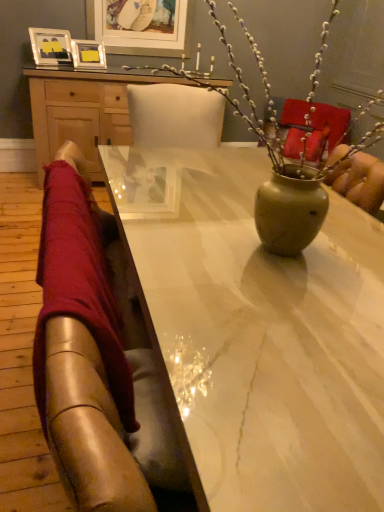
Question: Could wooden desk at upper center be considered to be inside matte green vase at center?

Choices:
 (A) no
 (B) yes

Answer: (A)

Question: Is matte green vase at center thinner than wooden desk at upper center?

Choices:
 (A) no
 (B) yes

Answer: (A)

Question: From the image's perspective, is matte green vase at center above wooden desk at upper center?

Choices:
 (A) yes
 (B) no

Answer: (B)

Question: Is matte green vase at center smaller than wooden desk at upper center?

Choices:
 (A) yes
 (B) no

Answer: (A)

Question: Does matte green vase at center have a lesser height compared to wooden desk at upper center?

Choices:
 (A) no
 (B) yes

Answer: (B)

Question: Would you say matte silver picture frame at upper left, which appears as the 3th picture frame when viewed from the right, is to the left or to the right of denim jeans at left in the picture?

Choices:
 (A) right
 (B) left

Answer: (B)

Question: Would you say matte silver picture frame at upper left, which appears as the 3th picture frame when viewed from the right, is inside or outside denim jeans at left?

Choices:
 (A) outside
 (B) inside

Answer: (A)

Question: From the image's perspective, is matte silver picture frame at upper left, which appears as the 3th picture frame when viewed from the right, positioned above or below denim jeans at left?

Choices:
 (A) above
 (B) below

Answer: (A)

Question: From a real-world perspective, is matte silver picture frame at upper left, which appears as the 3th picture frame when viewed from the right, physically located above or below denim jeans at left?

Choices:
 (A) above
 (B) below

Answer: (A)

Question: Considering the relative positions of matte green vase at center and matte silver picture frame at upper left, which appears as the second picture frame when viewed from the right, in the image provided, is matte green vase at center to the left or to the right of matte silver picture frame at upper left, which appears as the second picture frame when viewed from the right,?

Choices:
 (A) right
 (B) left

Answer: (A)

Question: From their relative heights in the image, would you say matte green vase at center is taller or shorter than matte silver picture frame at upper left, marked as the 2th picture frame in a left-to-right arrangement?

Choices:
 (A) short
 (B) tall

Answer: (B)

Question: Is matte green vase at center situated inside matte silver picture frame at upper left, which appears as the second picture frame when viewed from the right, or outside?

Choices:
 (A) inside
 (B) outside

Answer: (B)

Question: From the image's perspective, is matte green vase at center above or below matte silver picture frame at upper left, marked as the 2th picture frame in a left-to-right arrangement?

Choices:
 (A) below
 (B) above

Answer: (A)

Question: Considering the positions of matte white picture frame at upper center, marked as the 3th picture frame in a left-to-right arrangement, and denim jeans at left in the image, is matte white picture frame at upper center, marked as the 3th picture frame in a left-to-right arrangement, bigger or smaller than denim jeans at left?

Choices:
 (A) big
 (B) small

Answer: (B)

Question: Considering the positions of matte white picture frame at upper center, marked as the 3th picture frame in a left-to-right arrangement, and denim jeans at left in the image, is matte white picture frame at upper center, marked as the 3th picture frame in a left-to-right arrangement, taller or shorter than denim jeans at left?

Choices:
 (A) short
 (B) tall

Answer: (B)